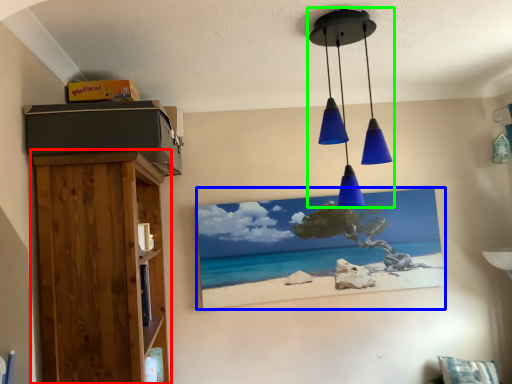
Question: Which object is the farthest from furniture (highlighted by a red box)? Choose among these: picture frame (highlighted by a blue box) or lamp (highlighted by a green box).

Choices:
 (A) picture frame
 (B) lamp

Answer: (A)